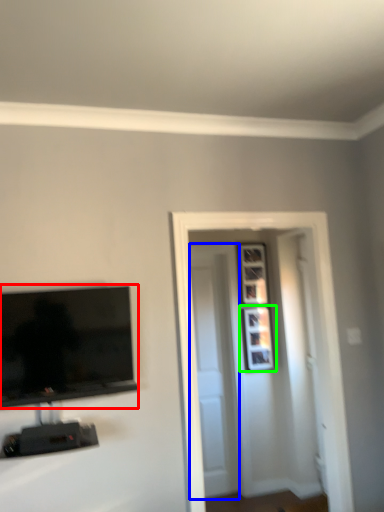
Question: Which is farther away from television (highlighted by a red box)? door (highlighted by a blue box) or picture frame (highlighted by a green box)?

Choices:
 (A) door
 (B) picture frame

Answer: (B)